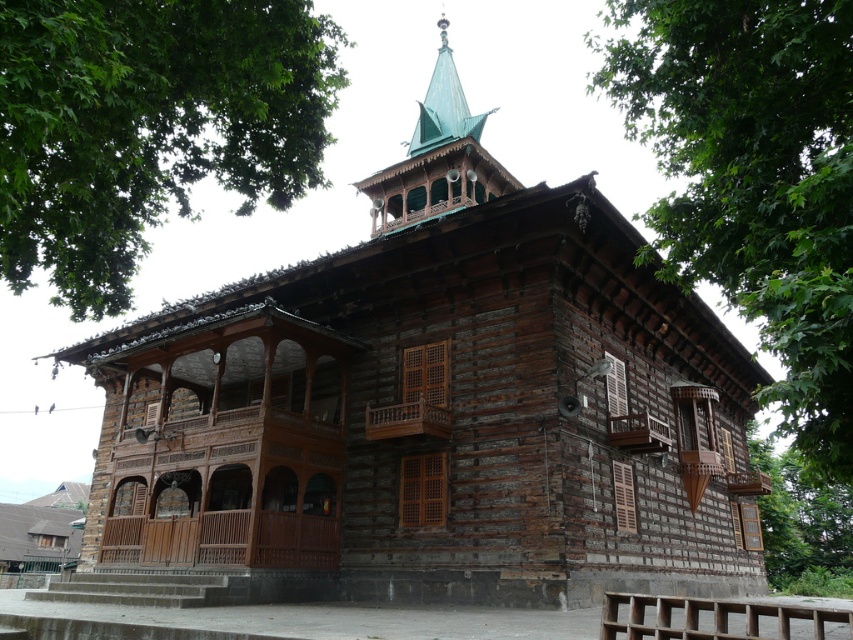
From the picture: You are an architect designing a new mosque and want to ensure the green copper spire at upper center is proportionally wider than the green leafy tree at upper right. Based on the image, is this currently the case?

The green leafy tree at upper right is wider than the green copper spire at upper center, so the spire is not proportionally wider than the tree.

You are planning to take a photo of the mosque and want to ensure both the green leafy tree at upper left and the green leafy tree at upper right are visible in the frame. Considering their sizes, which tree might require you to adjust your camera angle more to include it fully?

The green leafy tree at upper left is wider than the green leafy tree at upper right, so you might need to adjust your camera angle more to include the green leafy tree at upper left fully since it is wider.